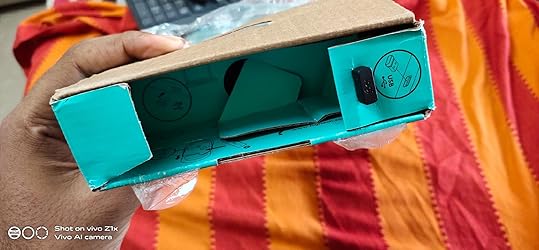
The image size is (539, 250). Find the location of `floor`. floor is located at coordinates (12, 65).